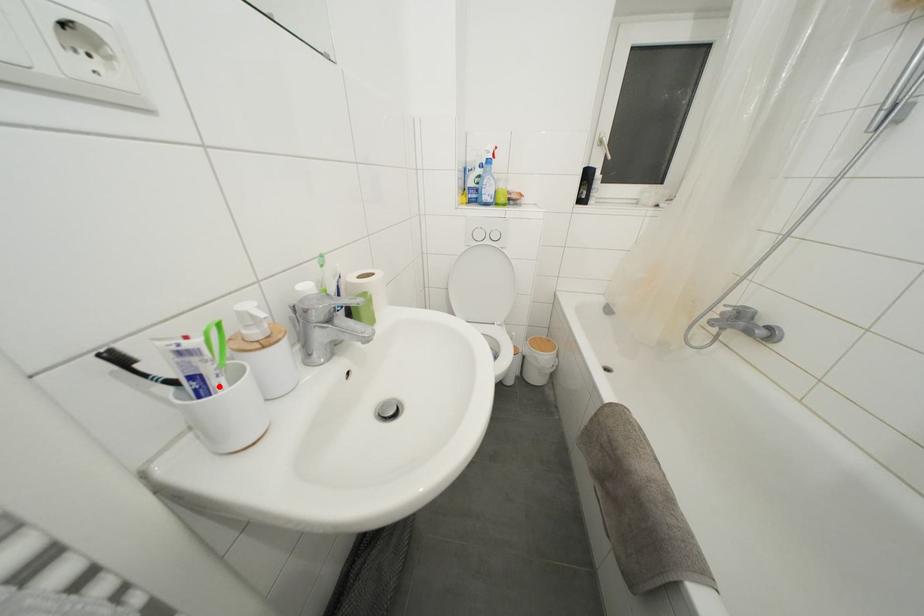
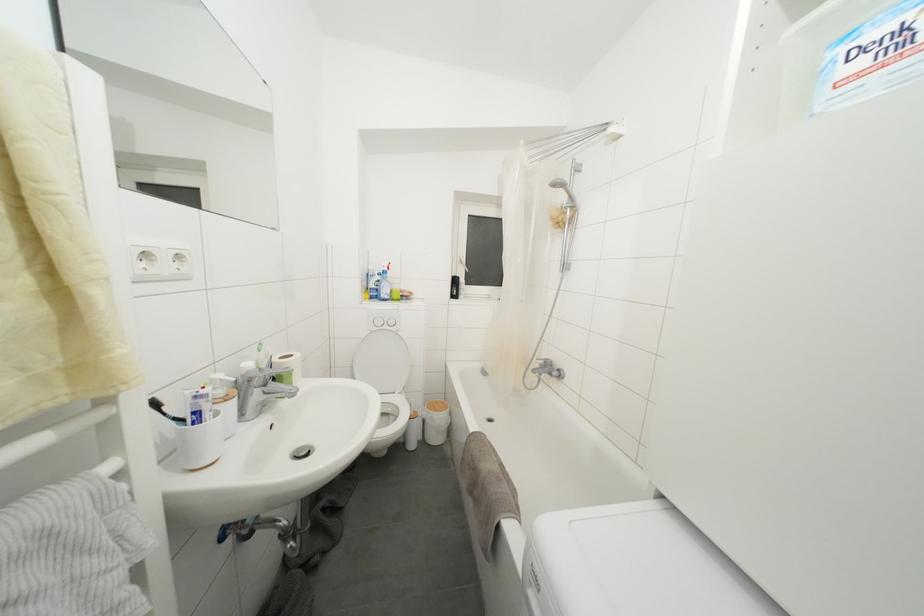
In the second image, find the point that corresponds to the highlighted location in the first image.

(211, 419)